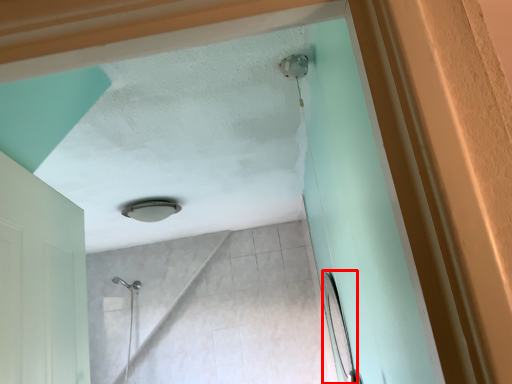
Question: From the image's perspective, what is the correct spatial positioning of mirror (annotated by the red box) in reference to lamp?

Choices:
 (A) above
 (B) below

Answer: (B)